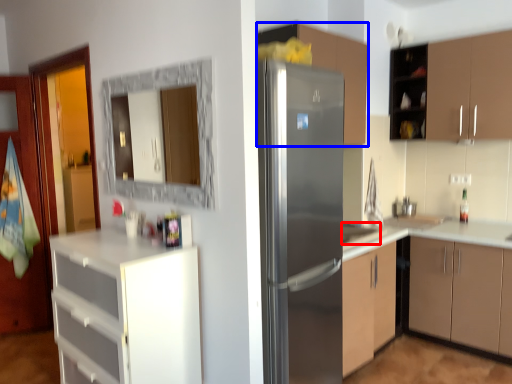
Question: Among these objects, which one is nearest to the camera, sink (highlighted by a red box) or cabinetry (highlighted by a blue box)?

Choices:
 (A) sink
 (B) cabinetry

Answer: (B)